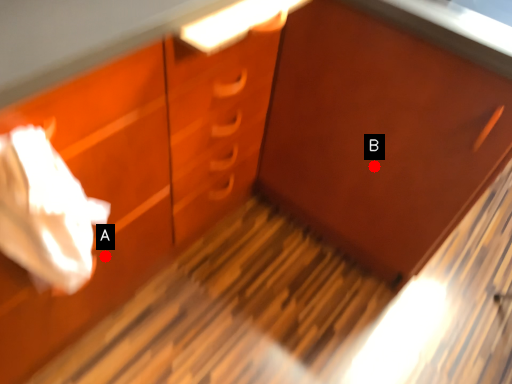
Question: Two points are circled on the image, labeled by A and B beside each circle. Which point is closer to the camera?

Choices:
 (A) A is closer
 (B) B is closer

Answer: (A)